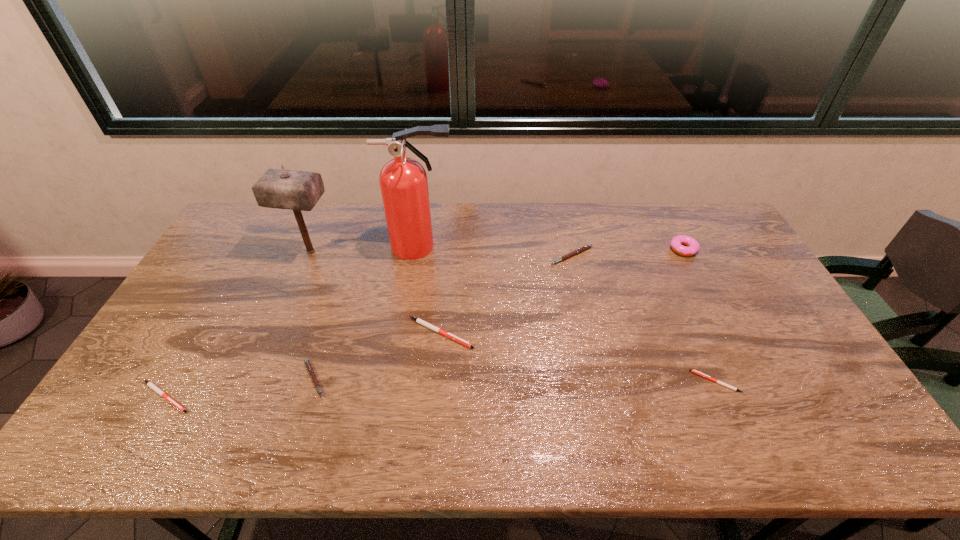
Locate an element on the screen. free space located at the nib of the nearer pink pen is located at coordinates (413, 379).

This screenshot has height=540, width=960. I want to click on free location located on the clicker of the second biggest white pen, so click(263, 396).

Find the location of a particular element. blank area located on the clicker of the shortest pen is located at coordinates (616, 382).

At what (x,y) coordinates should I click in order to perform the action: click on blank space located 0.200m on the clicker of the shortest pen. Please return your answer as a coordinate pair (x, y). This screenshot has width=960, height=540. Looking at the image, I should click on (616, 382).

Locate an element on the screen. vacant space located on the clicker of the shortest pen is located at coordinates [x=542, y=382].

Identify the location of fire extinguisher situated at the far edge. (403, 181).

At what (x,y) coordinates should I click in order to perform the action: click on mallet at the far edge. Please return your answer as a coordinate pair (x, y). The width and height of the screenshot is (960, 540). Looking at the image, I should click on (299, 191).

In order to click on doughnut at the far edge in this screenshot , I will do `click(676, 243)`.

Image resolution: width=960 pixels, height=540 pixels. Identify the location of object situated at the left edge. (150, 384).

Where is `object positioned at the right edge`? object positioned at the right edge is located at coordinates (676, 243).